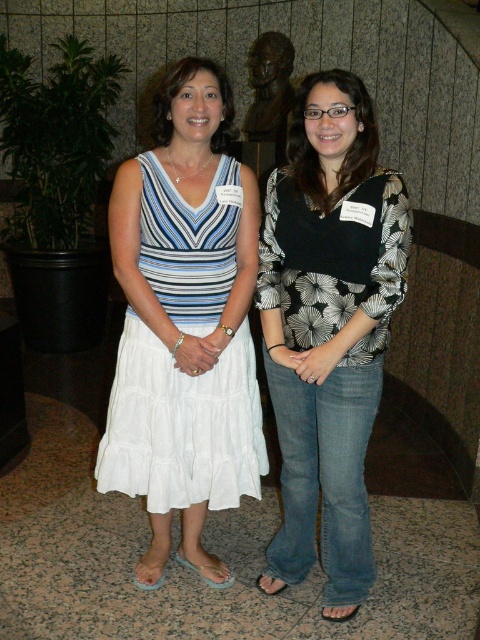
Question: Which of the following is the farthest from the observer?

Choices:
 (A) white cotton dress at center
 (B) bronze statue at center

Answer: (B)

Question: Observing the image, what is the correct spatial positioning of white cotton dress at center in reference to bronze statue at center?

Choices:
 (A) left
 (B) right

Answer: (A)

Question: Is black floral blouse at center wider than bronze statue at center?

Choices:
 (A) no
 (B) yes

Answer: (B)

Question: Can you confirm if black floral blouse at center is positioned to the right of bronze statue at center?

Choices:
 (A) yes
 (B) no

Answer: (A)

Question: Which point appears closest to the camera in this image?

Choices:
 (A) (361, 176)
 (B) (252, 387)
 (C) (259, 72)

Answer: (A)

Question: Which point is closer to the camera?

Choices:
 (A) (265, 77)
 (B) (279, 220)
 (C) (137, 465)

Answer: (B)